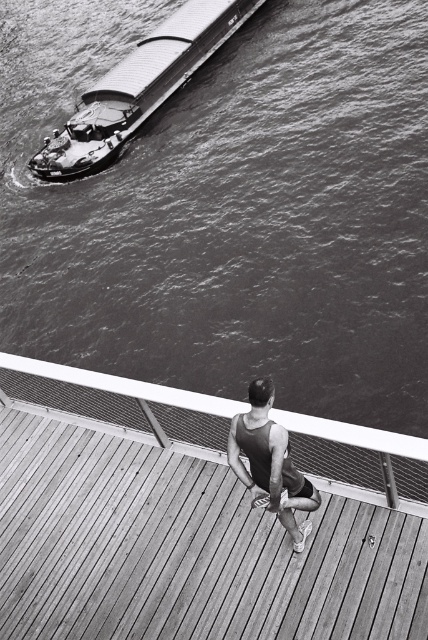
The width and height of the screenshot is (428, 640). Describe the element at coordinates (195, 518) in the screenshot. I see `wooden at center` at that location.

Is point (145, 506) positioned before point (294, 467)?

No, (145, 506) is further to viewer.

The height and width of the screenshot is (640, 428). Find the location of `wooden at center`. wooden at center is located at coordinates coord(195,518).

Which of these two, smooth water at upper left or metallic gray barge at upper left, stands taller?

Standing taller between the two is smooth water at upper left.

Between smooth water at upper left and metallic gray barge at upper left, which one has less height?

With less height is metallic gray barge at upper left.

Is point (146, 212) closer to viewer compared to point (45, 145)?

Yes, point (146, 212) is closer to viewer.

At what (x,y) coordinates should I click in order to perform the action: click on smooth water at upper left. Please return your answer as a coordinate pair (x, y). Looking at the image, I should click on (229, 209).

Which is below, wooden at center or metallic gray barge at upper left?

wooden at center is below.

Which is more to the right, wooden at center or metallic gray barge at upper left?

Positioned to the right is wooden at center.

Looking at this image, who is more forward, (122,388) or (125,113)?

Positioned in front is point (122,388).

At what (x,y) coordinates should I click in order to perform the action: click on wooden at center. Please return your answer as a coordinate pair (x, y). This screenshot has height=640, width=428. Looking at the image, I should click on (195, 518).